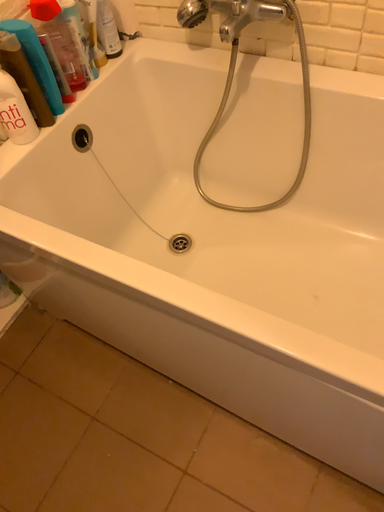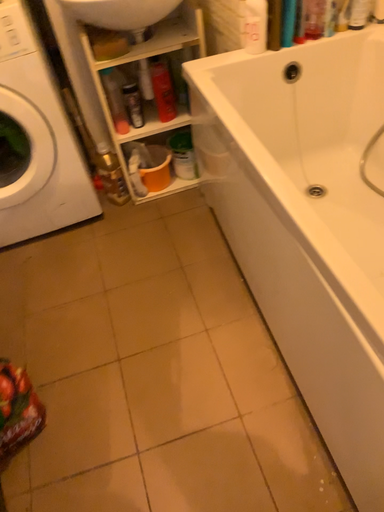
Question: Which way did the camera rotate in the video?

Choices:
 (A) rotated right
 (B) rotated left

Answer: (B)